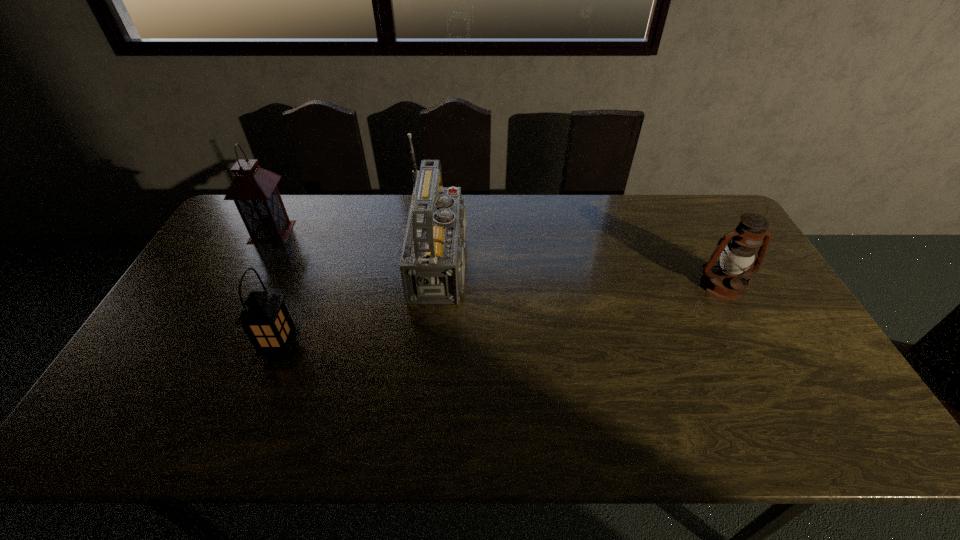
This screenshot has height=540, width=960. Find the location of `free spot between the leftmost object and the third object from left to right`. free spot between the leftmost object and the third object from left to right is located at coordinates (360, 247).

This screenshot has width=960, height=540. What are the coordinates of `the third closest object to the radio receiver` in the screenshot? It's located at (727, 281).

In order to click on object that is the closest to the nearest lantern in this screenshot , I will do `click(432, 265)`.

You are a GUI agent. You are given a task and a screenshot of the screen. Output one action in this format:
    pyautogui.click(x=<x>, y=<y>)
    Task: Click on the lantern object that ranks as the closest to the third object from right to left
    This screenshot has width=960, height=540.
    Given the screenshot: What is the action you would take?
    pyautogui.click(x=254, y=190)

Locate an element on the screen. lantern that is the second nearest to the rightmost object is located at coordinates (254, 190).